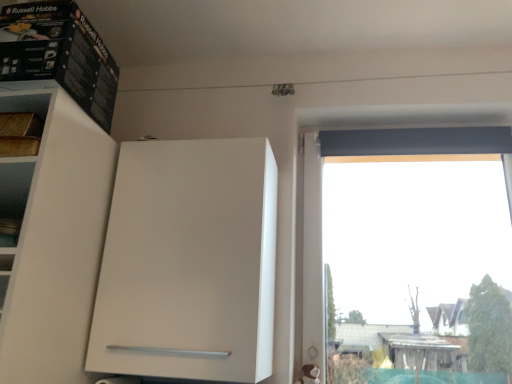
Where is `white matte cabinet at center`? white matte cabinet at center is located at coordinates (188, 262).

What do you see at coordinates (188, 262) in the screenshot?
I see `white matte cabinet at center` at bounding box center [188, 262].

What is the approximate width of white matte cabinet at center?

It is 12.46 inches.

In the scene shown: Measure the distance between black cardboard box at upper left and camera.

black cardboard box at upper left is 3.68 feet away from camera.

What is the approximate width of black cardboard box at upper left?

17.31 inches.

The height and width of the screenshot is (384, 512). I want to click on black cardboard box at upper left, so click(x=59, y=54).

Describe the element at coordinates (59, 54) in the screenshot. The width and height of the screenshot is (512, 384). I see `black cardboard box at upper left` at that location.

Locate an element on the screen. This screenshot has height=384, width=512. white matte cabinet at center is located at coordinates (188, 262).

Does black cardboard box at upper left appear on the right side of white matte cabinet at center?

Incorrect, black cardboard box at upper left is not on the right side of white matte cabinet at center.

In the scene shown: Does black cardboard box at upper left lie in front of white matte cabinet at center?

Yes, it is in front of white matte cabinet at center.

Is point (42, 74) closer or farther from the camera than point (170, 216)?

Clearly, point (42, 74) is closer to the camera than point (170, 216).

Based on the photo, from the image's perspective, which one is positioned higher, black cardboard box at upper left or white matte cabinet at center?

black cardboard box at upper left.

From a real-world perspective, is black cardboard box at upper left physically below white matte cabinet at center?

Incorrect, from a real-world perspective, black cardboard box at upper left is higher than white matte cabinet at center.

Considering the relative sizes of black cardboard box at upper left and white matte cabinet at center in the image provided, is black cardboard box at upper left thinner than white matte cabinet at center?

Incorrect, the width of black cardboard box at upper left is not less than that of white matte cabinet at center.

Considering the sizes of objects black cardboard box at upper left and white matte cabinet at center in the image provided, who is taller, black cardboard box at upper left or white matte cabinet at center?

With more height is white matte cabinet at center.

Between black cardboard box at upper left and white matte cabinet at center, which one has smaller size?

Smaller between the two is black cardboard box at upper left.

Is black cardboard box at upper left not inside white matte cabinet at center?

That's correct, black cardboard box at upper left is outside of white matte cabinet at center.

Consider the image. Is black cardboard box at upper left far from white matte cabinet at center?

No.

Could you tell me if black cardboard box at upper left is facing white matte cabinet at center?

No, black cardboard box at upper left is not aimed at white matte cabinet at center.

Find the location of a particular element. cabinet above the white matte cabinet at center (from the image's perspective) is located at coordinates click(59, 54).

Considering the positions of objects white matte cabinet at center and black cardboard box at upper left in the image provided, who is more to the left, white matte cabinet at center or black cardboard box at upper left?

Positioned to the left is black cardboard box at upper left.

Which is in front, white matte cabinet at center or black cardboard box at upper left?

black cardboard box at upper left is closer to the camera.

Is point (254, 190) positioned in front of point (54, 49)?

No.

From the image's perspective, which one is positioned lower, white matte cabinet at center or black cardboard box at upper left?

white matte cabinet at center is shown below in the image.

From a real-world perspective, is white matte cabinet at center beneath black cardboard box at upper left?

Yes.

Considering the sizes of objects white matte cabinet at center and black cardboard box at upper left in the image provided, who is wider, white matte cabinet at center or black cardboard box at upper left?

With larger width is black cardboard box at upper left.

Between white matte cabinet at center and black cardboard box at upper left, which one has more height?

white matte cabinet at center.

Considering the sizes of objects white matte cabinet at center and black cardboard box at upper left in the image provided, who is smaller, white matte cabinet at center or black cardboard box at upper left?

Smaller between the two is black cardboard box at upper left.

Can black cardboard box at upper left be found inside white matte cabinet at center?

No.

Is white matte cabinet at center positioned far away from black cardboard box at upper left?

That's not correct — white matte cabinet at center is a little close to black cardboard box at upper left.

Is white matte cabinet at center oriented away from black cardboard box at upper left?

No, white matte cabinet at center is not facing away from black cardboard box at upper left.

Image resolution: width=512 pixels, height=384 pixels. I want to click on cabinetry below the black cardboard box at upper left (from a real-world perspective), so click(188, 262).

At what (x,y) coordinates should I click in order to perform the action: click on cabinet above the white matte cabinet at center (from a real-world perspective). Please return your answer as a coordinate pair (x, y). This screenshot has width=512, height=384. Looking at the image, I should click on 59,54.

Identify the location of cabinetry on the right of the black cardboard box at upper left. The image size is (512, 384). (188, 262).